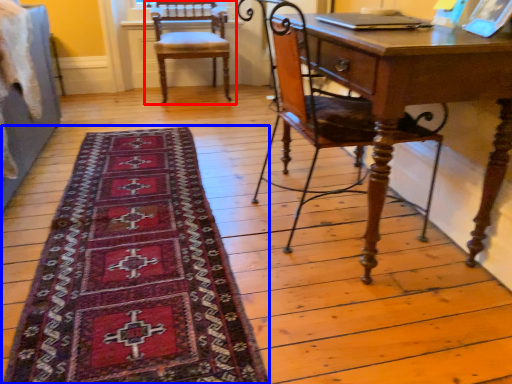
Question: Which point is further to the camera, chair (highlighted by a red box) or mat (highlighted by a blue box)?

Choices:
 (A) chair
 (B) mat

Answer: (A)